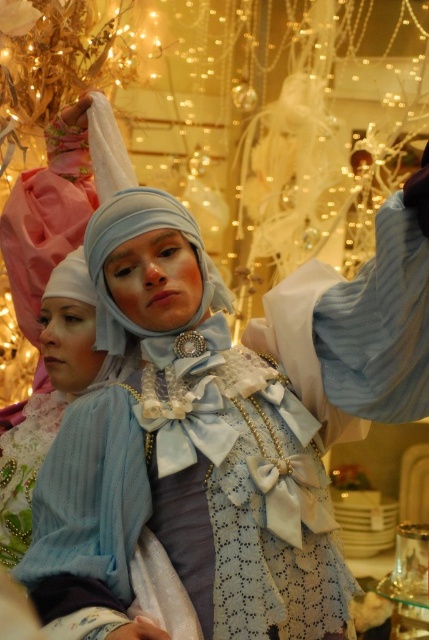
Is matte blue fabric dress at center positioned at the back of light blue fabric headdress at center?

No, it is not.

Between point (75, 525) and point (208, 305), which one is positioned behind?

Point (208, 305)

Find the location of a particular element. The image size is (429, 640). matte blue fabric dress at center is located at coordinates (181, 460).